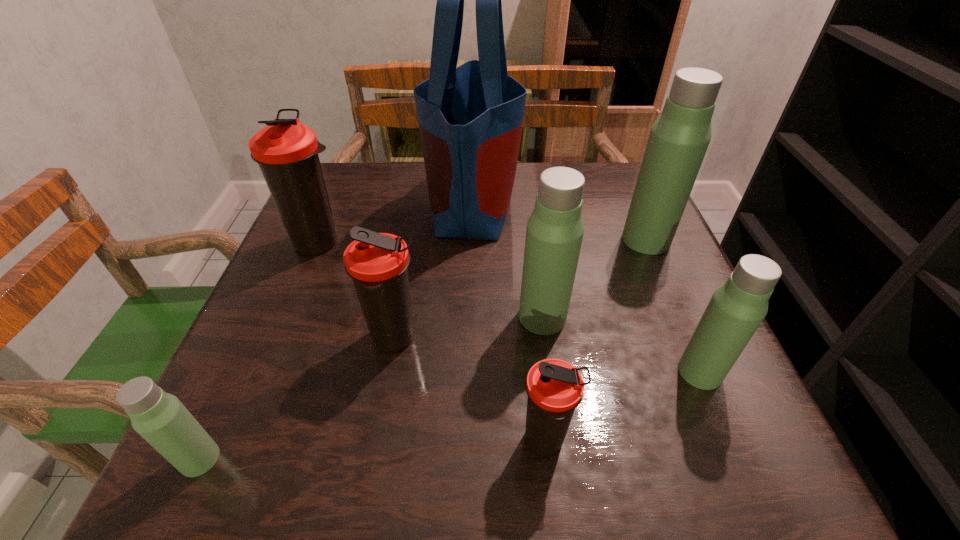
At what (x,y) coordinates should I click in order to perform the action: click on the closest object relative to the rightmost brown thermos bottle. Please return your answer as a coordinate pair (x, y). Looking at the image, I should click on (555, 229).

The height and width of the screenshot is (540, 960). I want to click on the closest object to the second light thermos bottle from left to right, so click(470, 118).

Where is `the fourth closest thermos bottle relative to the leftmost brown thermos bottle`? Image resolution: width=960 pixels, height=540 pixels. the fourth closest thermos bottle relative to the leftmost brown thermos bottle is located at coordinates (555, 388).

In order to click on the closest thermos bottle relative to the nearest light thermos bottle in this screenshot , I will do `click(378, 263)`.

Find the location of a particular element. This screenshot has height=540, width=960. light thermos bottle identified as the second closest to the farthest light thermos bottle is located at coordinates (736, 309).

Image resolution: width=960 pixels, height=540 pixels. Find the location of `the second closest light thermos bottle to the second farthest light thermos bottle`. the second closest light thermos bottle to the second farthest light thermos bottle is located at coordinates (679, 138).

Point out which brown thermos bottle is positioned as the nearest to the farthest brown thermos bottle. Please provide its 2D coordinates. Your answer should be formatted as a tuple, i.e. [(x, y)], where the tuple contains the x and y coordinates of a point satisfying the conditions above.

[(378, 263)]

I want to click on brown thermos bottle that is the second closest to the leftmost brown thermos bottle, so click(555, 388).

Identify the location of free space that satisfies the following two spatial constraints: 1. on the front side of the handbag; 2. on the right side of the third biggest light thermos bottle. This screenshot has height=540, width=960. (468, 372).

This screenshot has height=540, width=960. In order to click on free point that satisfies the following two spatial constraints: 1. on the back side of the nearest light thermos bottle; 2. on the left side of the third smallest light thermos bottle in this screenshot , I will do `click(265, 317)`.